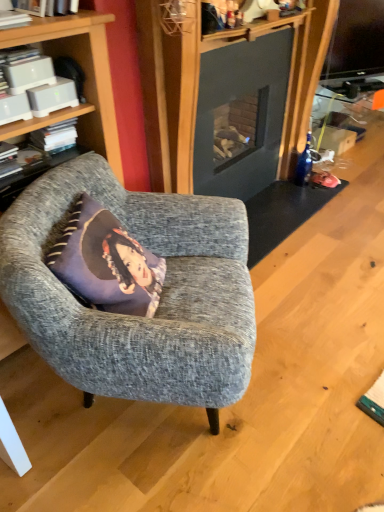
Question: Is purple fabric pillow at center taller than dark gray fabric cushion at left?

Choices:
 (A) no
 (B) yes

Answer: (B)

Question: Is purple fabric pillow at center positioned before dark gray fabric cushion at left?

Choices:
 (A) yes
 (B) no

Answer: (A)

Question: From a real-world perspective, is purple fabric pillow at center on top of dark gray fabric cushion at left?

Choices:
 (A) no
 (B) yes

Answer: (A)

Question: Considering the relative sizes of purple fabric pillow at center and dark gray fabric cushion at left in the image provided, is purple fabric pillow at center smaller than dark gray fabric cushion at left?

Choices:
 (A) no
 (B) yes

Answer: (A)

Question: Is purple fabric pillow at center outside of dark gray fabric cushion at left?

Choices:
 (A) no
 (B) yes

Answer: (B)

Question: Is purple fabric pillow at center turned away from dark gray fabric cushion at left?

Choices:
 (A) no
 (B) yes

Answer: (A)

Question: Could you tell me if white plastic book at upper left, which appears as the 2th book when viewed from the front, is facing white matte book at left, positioned as the first book in back-to-front order?

Choices:
 (A) yes
 (B) no

Answer: (B)

Question: Considering the relative sizes of white plastic book at upper left, the second book positioned from the back, and white matte book at left, positioned as the first book in back-to-front order, in the image provided, is white plastic book at upper left, the second book positioned from the back, bigger than white matte book at left, positioned as the first book in back-to-front order,?

Choices:
 (A) no
 (B) yes

Answer: (B)

Question: Is white plastic book at upper left, which appears as the 2th book when viewed from the front, next to white matte book at left, the third book when ordered from front to back, and touching it?

Choices:
 (A) yes
 (B) no

Answer: (B)

Question: From a real-world perspective, is white plastic book at upper left, the second book positioned from the back, positioned over white matte book at left, the third book when ordered from front to back, based on gravity?

Choices:
 (A) yes
 (B) no

Answer: (A)

Question: Does white plastic book at upper left, the second book positioned from the back, have a smaller size compared to white matte book at left, the third book when ordered from front to back?

Choices:
 (A) no
 (B) yes

Answer: (A)

Question: Considering the relative positions of white plastic book at upper left, which appears as the 2th book when viewed from the front, and white matte book at left, positioned as the first book in back-to-front order, in the image provided, is white plastic book at upper left, which appears as the 2th book when viewed from the front, to the left of white matte book at left, positioned as the first book in back-to-front order, from the viewer's perspective?

Choices:
 (A) no
 (B) yes

Answer: (B)

Question: Could you tell me if white plastic book at upper left, the second book positioned from the back, is facing white matte book at upper left, which is the 3th book from back to front?

Choices:
 (A) yes
 (B) no

Answer: (B)